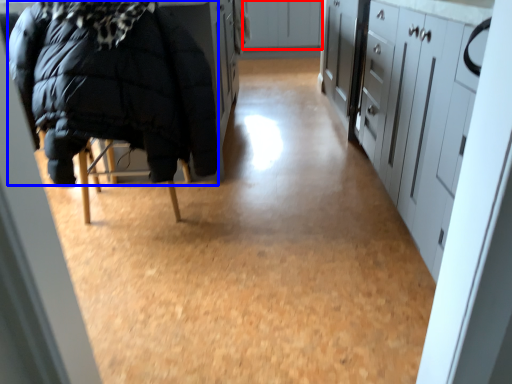
Question: Which of the following is the farthest to the observer, cabinetry (highlighted by a red box) or jacket (highlighted by a blue box)?

Choices:
 (A) cabinetry
 (B) jacket

Answer: (A)